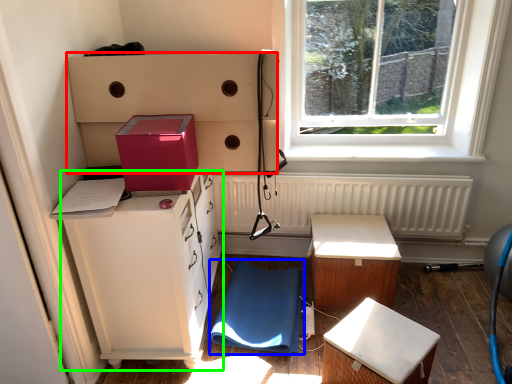
Question: Which object is positioned farthest from shelf (highlighted by a red box)? Select from swivel chair (highlighted by a blue box) and cabinetry (highlighted by a green box).

Choices:
 (A) swivel chair
 (B) cabinetry

Answer: (A)